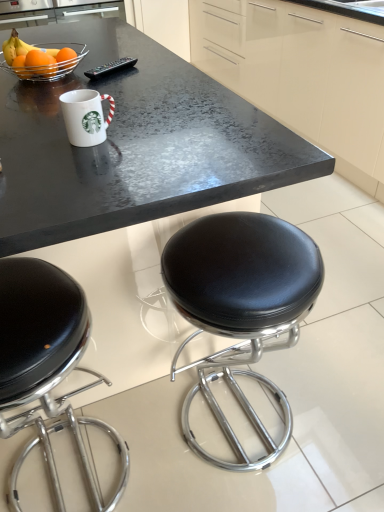
You are a GUI agent. You are given a task and a screenshot of the screen. Output one action in this format:
    pyautogui.click(x=<x>, y=<y>)
    Task: Click on the free space in front of metallic wire basket at upper left
    This screenshot has height=512, width=384.
    Given the screenshot: What is the action you would take?
    pyautogui.click(x=43, y=97)